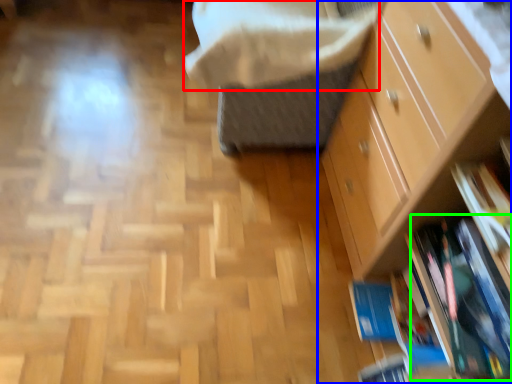
Question: Which is nearer to the blanket (highlighted by a red box)? chest of drawers (highlighted by a blue box) or book (highlighted by a green box).

Choices:
 (A) chest of drawers
 (B) book

Answer: (A)